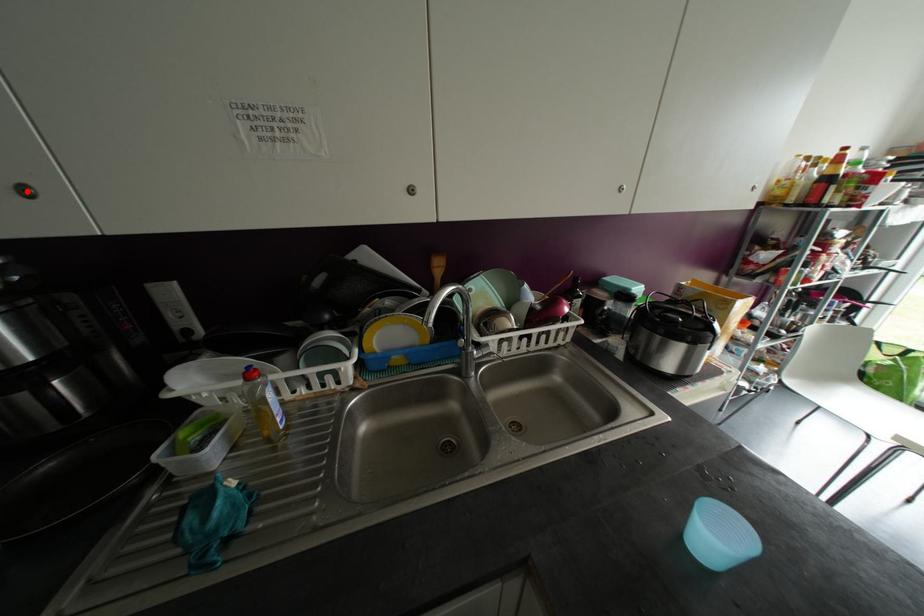
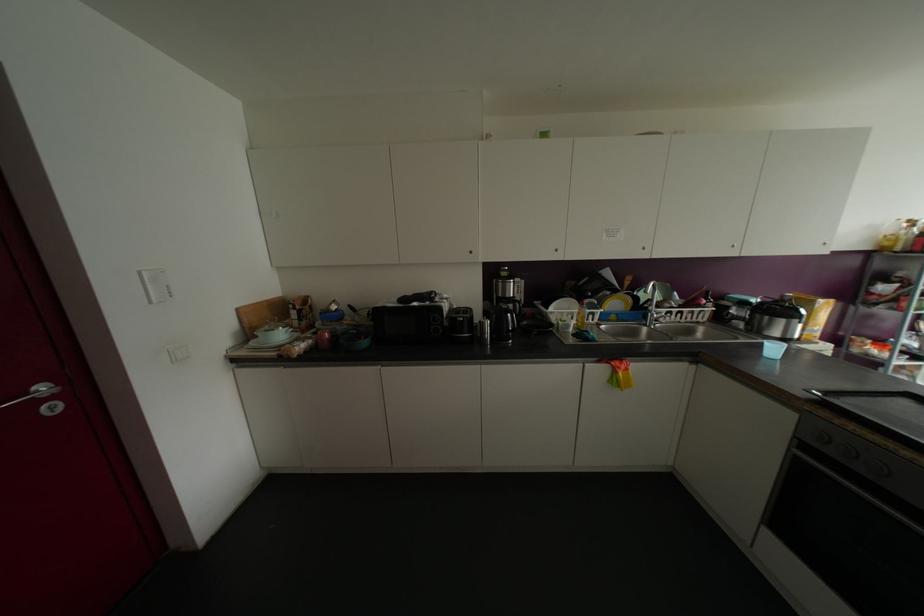
Find the pixel in the second image that matches the highlighted location in the first image.

(555, 249)